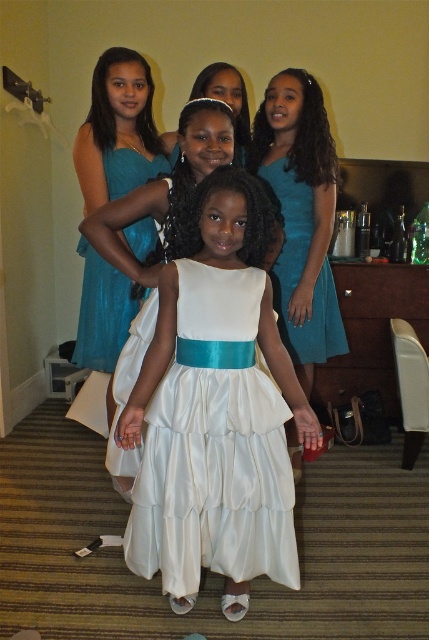
Which is more to the left, white satin dress at center or teal satin dress at upper center?

teal satin dress at upper center is more to the left.

What are the coordinates of `white satin dress at center` in the screenshot? It's located at (214, 445).

Does teal satin dress at upper center have a smaller size compared to teal satin dress at center?

No.

The image size is (429, 640). What do you see at coordinates (102, 310) in the screenshot?
I see `teal satin dress at upper center` at bounding box center [102, 310].

Find the location of a particular element. teal satin dress at upper center is located at coordinates (102, 310).

Is point (168, 474) in front of point (302, 198)?

Yes, it is.

Does white satin dress at center have a larger size compared to teal satin dress at center?

Indeed, white satin dress at center has a larger size compared to teal satin dress at center.

Where is `white satin dress at center`? The image size is (429, 640). white satin dress at center is located at coordinates (214, 445).

The height and width of the screenshot is (640, 429). In order to click on white satin dress at center in this screenshot , I will do `click(214, 445)`.